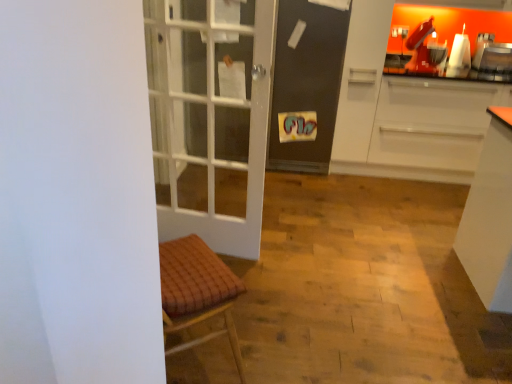
Question: Is metallic silver toaster at upper right surrounded by white matte cabinet at right?

Choices:
 (A) yes
 (B) no

Answer: (A)

Question: Is white matte cabinet at right positioned in front of metallic silver toaster at upper right?

Choices:
 (A) no
 (B) yes

Answer: (B)

Question: Is white matte cabinet at right completely or partially outside of metallic silver toaster at upper right?

Choices:
 (A) no
 (B) yes

Answer: (B)

Question: Is white matte cabinet at right taller than metallic silver toaster at upper right?

Choices:
 (A) no
 (B) yes

Answer: (B)

Question: From a real-world perspective, is white matte cabinet at right physically below metallic silver toaster at upper right?

Choices:
 (A) yes
 (B) no

Answer: (A)

Question: In the image, is metallic silver toaster at upper right positioned in front of or behind white matte cabinet at right?

Choices:
 (A) behind
 (B) front

Answer: (A)

Question: From a real-world perspective, is metallic silver toaster at upper right positioned above or below white matte cabinet at right?

Choices:
 (A) below
 (B) above

Answer: (B)

Question: Based on their sizes in the image, would you say metallic silver toaster at upper right is bigger or smaller than white matte cabinet at right?

Choices:
 (A) big
 (B) small

Answer: (B)

Question: Does point click(x=501, y=51) appear closer or farther from the camera than point click(x=399, y=82)?

Choices:
 (A) closer
 (B) farther

Answer: (B)

Question: Considering their positions, is metallic silver toaster at upper right located in front of or behind matte black screen door at center?

Choices:
 (A) front
 (B) behind

Answer: (B)

Question: From a real-world perspective, is metallic silver toaster at upper right physically located above or below matte black screen door at center?

Choices:
 (A) above
 (B) below

Answer: (A)

Question: Considering the positions of metallic silver toaster at upper right and matte black screen door at center in the image, is metallic silver toaster at upper right wider or thinner than matte black screen door at center?

Choices:
 (A) thin
 (B) wide

Answer: (A)

Question: Based on their positions, is metallic silver toaster at upper right located to the left or right of matte black screen door at center?

Choices:
 (A) left
 (B) right

Answer: (B)

Question: Considering their positions, is white matte cabinet at right located in front of or behind matte black screen door at center?

Choices:
 (A) front
 (B) behind

Answer: (A)

Question: Considering the positions of white matte cabinet at right and matte black screen door at center in the image, is white matte cabinet at right wider or thinner than matte black screen door at center?

Choices:
 (A) thin
 (B) wide

Answer: (A)